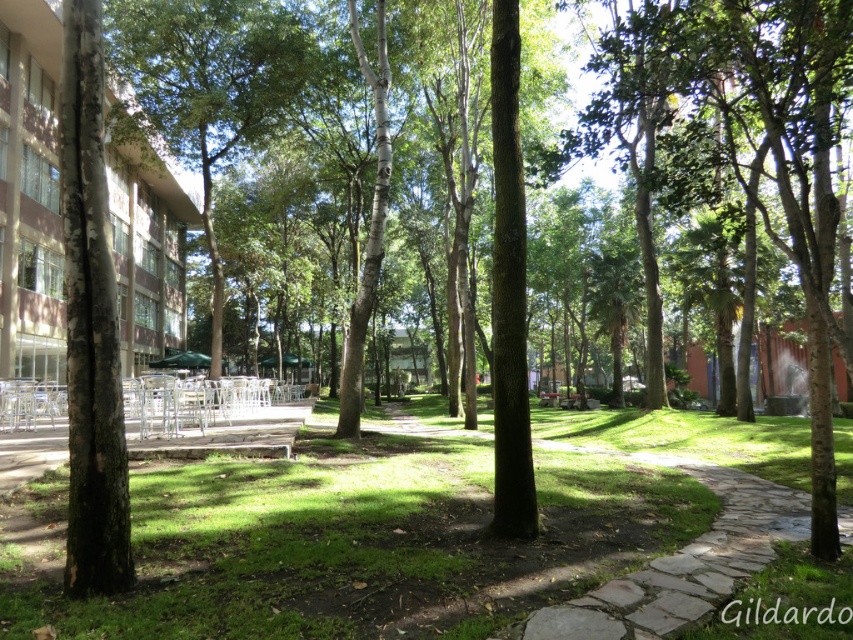
Does green grass at center have a smaller size compared to green leafy tree at center?

Indeed, green grass at center has a smaller size compared to green leafy tree at center.

Does green grass at center appear under green leafy tree at center?

Yes.

Who is more distant from viewer, (0, 609) or (201, 35)?

The point (201, 35) is behind.

You are a GUI agent. You are given a task and a screenshot of the screen. Output one action in this format:
    pyautogui.click(x=<x>, y=<y>)
    Task: Click on the green grass at center
    
    Given the screenshot: What is the action you would take?
    pyautogui.click(x=360, y=544)

Does green grass at center appear under green bark tree at left?

Yes, green grass at center is below green bark tree at left.

Can you confirm if green grass at center is bigger than green bark tree at left?

Indeed, green grass at center has a larger size compared to green bark tree at left.

Is point (138, 465) closer to viewer compared to point (79, 460)?

No, (138, 465) is further to viewer.

Identify the location of green grass at center. Image resolution: width=853 pixels, height=640 pixels. (360, 544).

Does point (70, 486) lie behind point (166, 6)?

No, it is in front of (166, 6).

Between point (103, 416) and point (231, 10), which one is positioned behind?

Point (231, 10)

Where is `green bark tree at left`? The image size is (853, 640). green bark tree at left is located at coordinates (90, 324).